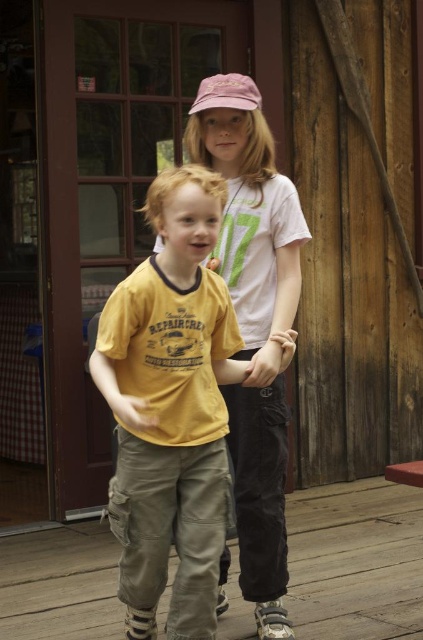
Question: Is yellow cotton t-shirt at center in front of wooden deck at center?

Choices:
 (A) no
 (B) yes

Answer: (B)

Question: Estimate the real-world distances between objects in this image. Which object is closer to the wooden deck at center?

Choices:
 (A) yellow cotton t-shirt at center
 (B) pink fabric shirt at center

Answer: (B)

Question: Among these objects, which one is nearest to the camera?

Choices:
 (A) yellow cotton t-shirt at center
 (B) pink fabric shirt at center

Answer: (A)

Question: Which of the following is the farthest from the observer?

Choices:
 (A) pink fabric shirt at center
 (B) wooden deck at center
 (C) yellow cotton t-shirt at center

Answer: (B)

Question: Observing the image, what is the correct spatial positioning of yellow cotton t-shirt at center in reference to pink fabric shirt at center?

Choices:
 (A) left
 (B) right

Answer: (A)

Question: In this image, where is yellow cotton t-shirt at center located relative to pink fabric shirt at center?

Choices:
 (A) right
 (B) left

Answer: (B)